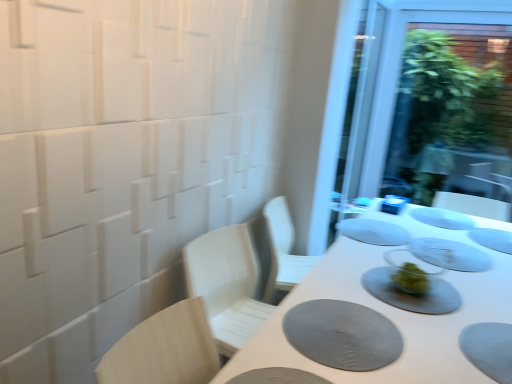
Find the location of a particular element. The width and height of the screenshot is (512, 384). free spot above matte gray placemat at center, the first tableware in the front-to-back sequence (from a real-world perspective) is located at coordinates (401, 284).